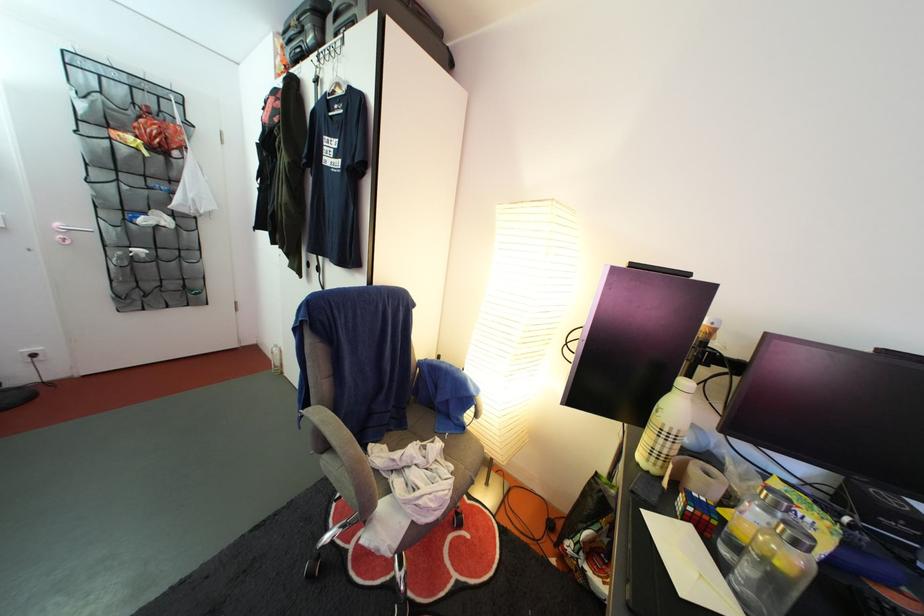
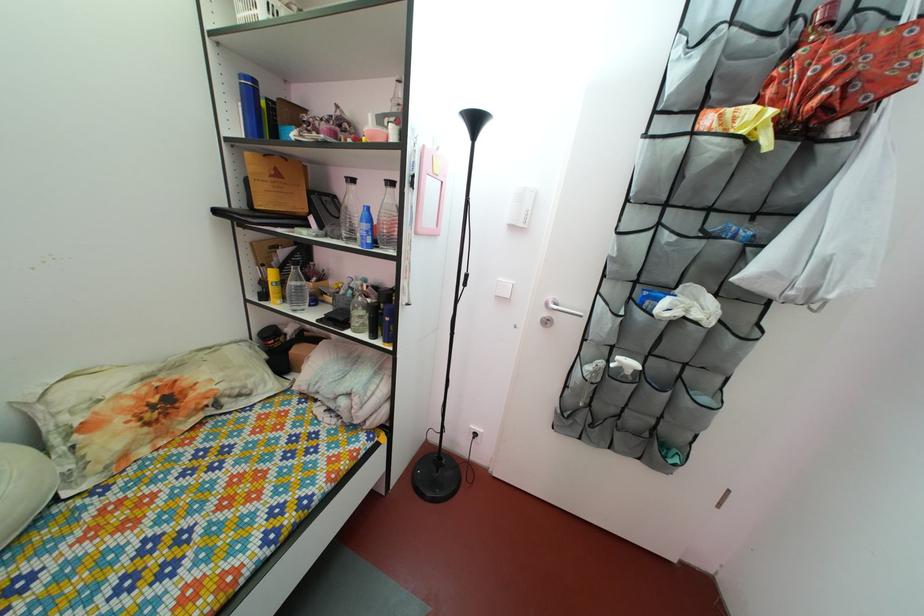
Find the pixel in the second image that matches (x=161, y=148) in the first image.

(816, 103)